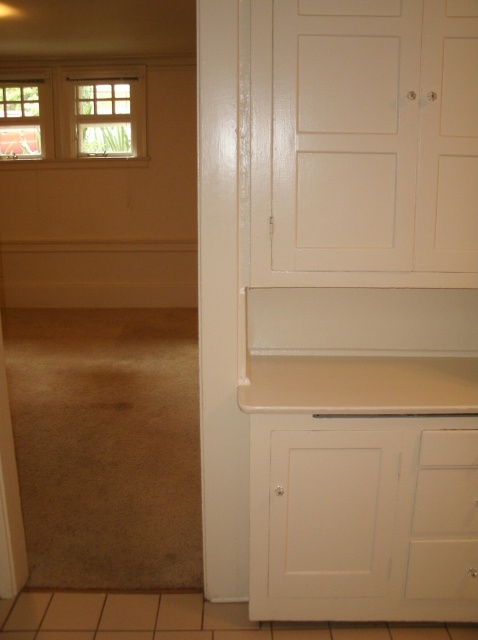
This screenshot has width=478, height=640. Describe the element at coordinates (105, 115) in the screenshot. I see `wooden window at upper left` at that location.

Consider the image. Is wooden window at upper left bigger than clear glass window at upper left?

Yes, wooden window at upper left is bigger than clear glass window at upper left.

Measure the distance between point (x=93, y=145) and camera.

Point (x=93, y=145) and camera are 37.97 feet apart from each other.

I want to click on wooden window at upper left, so coord(105,115).

Can you confirm if matte glass window at upper left is positioned above wooden window at upper left?

Indeed, matte glass window at upper left is positioned over wooden window at upper left.

Can you confirm if matte glass window at upper left is shorter than wooden window at upper left?

Indeed, matte glass window at upper left has a lesser height compared to wooden window at upper left.

Which is behind, point (87, 154) or point (113, 141)?

The point (113, 141) is more distant.

Identify the location of matte glass window at upper left. The image size is (478, 640). (73, 113).

Between matte glass window at upper left and clear glass window at upper left, which one has less height?

With less height is clear glass window at upper left.

Between matte glass window at upper left and clear glass window at upper left, which one has more height?

matte glass window at upper left is taller.

Is point (88, 113) positioned after point (1, 125)?

Yes, it is behind point (1, 125).

Identify the location of matte glass window at upper left. The image size is (478, 640). click(73, 113).